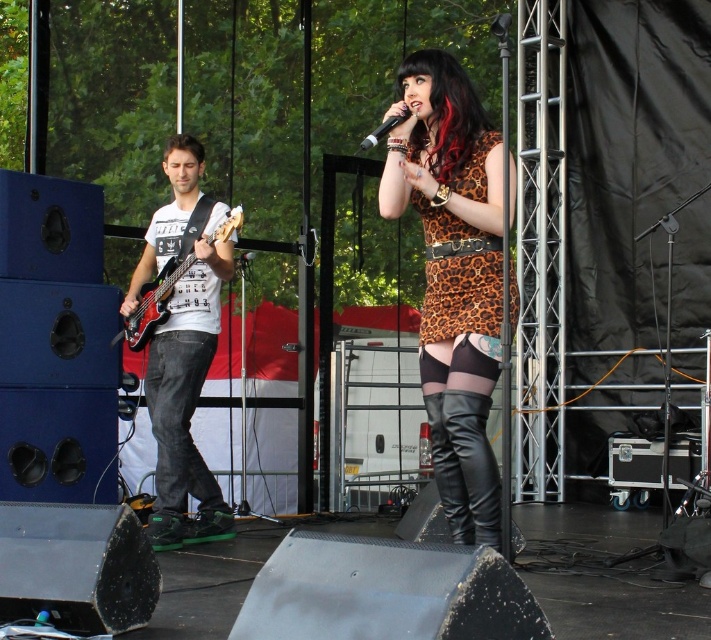
Question: Is matte black bass guitar at left bigger than matte black microphone at center?

Choices:
 (A) yes
 (B) no

Answer: (A)

Question: Can you confirm if matte black bass guitar at left is thinner than matte black microphone at center?

Choices:
 (A) no
 (B) yes

Answer: (A)

Question: Which object is farther from the camera taking this photo?

Choices:
 (A) leopard print dress at center
 (B) leather boots at center
 (C) matte black bass guitar at left

Answer: (C)

Question: Does matte black bass guitar at left have a lesser width compared to shiny black electric guitar at left?

Choices:
 (A) yes
 (B) no

Answer: (A)

Question: Which is farther from the matte black microphone at center?

Choices:
 (A) leopard print dress at center
 (B) leather boots at center

Answer: (B)

Question: Which of these objects is positioned closest to the leopard print dress at center?

Choices:
 (A) matte black microphone at center
 (B) shiny black electric guitar at left

Answer: (A)